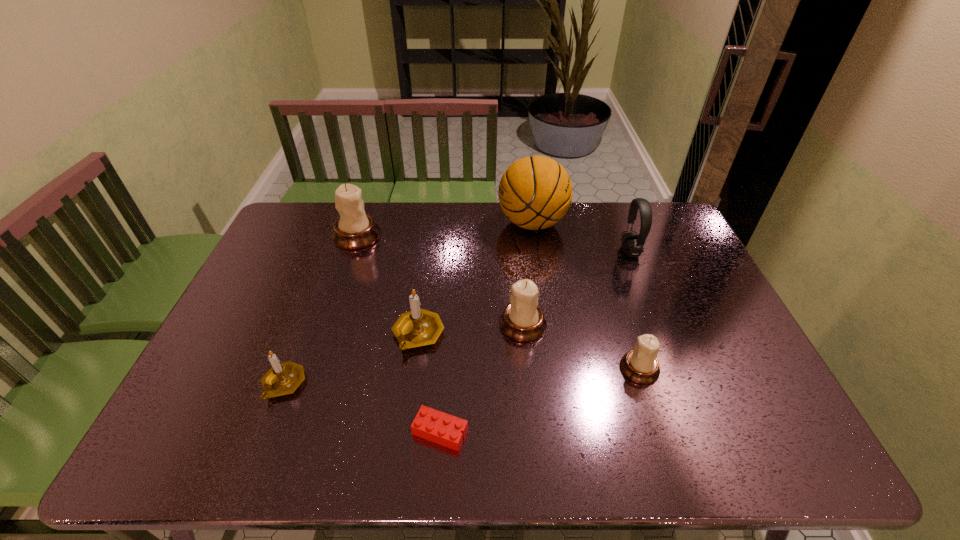
The height and width of the screenshot is (540, 960). I want to click on free spot located 0.070m on the front-facing side of the headset, so click(x=600, y=252).

At what (x,y) coordinates should I click in order to perform the action: click on free point located 0.280m on the front-facing side of the headset. Please return your answer as a coordinate pair (x, y). This screenshot has width=960, height=540. Looking at the image, I should click on (538, 252).

This screenshot has width=960, height=540. What are the coordinates of `free region located 0.210m on the left of the second farthest white candle holder` in the screenshot? It's located at (425, 325).

Where is `free space located 0.270m on the right of the right gold candle holder`? free space located 0.270m on the right of the right gold candle holder is located at coordinates (541, 334).

The height and width of the screenshot is (540, 960). I want to click on vacant space positioned on the back of the rightmost candle holder, so click(x=613, y=288).

I want to click on vacant space located 0.220m on the right of the smaller gold candle holder, so click(x=394, y=384).

The image size is (960, 540). I want to click on vacant space located 0.130m on the back of the red Lego, so tap(444, 368).

Identify the location of basketball at the far edge. [x=535, y=192].

You are a GUI agent. You are given a task and a screenshot of the screen. Output one action in this format:
    pyautogui.click(x=<x>, y=<y>)
    Task: Click on the candle holder that is at the far edge
    
    Given the screenshot: What is the action you would take?
    pyautogui.click(x=354, y=229)

The width and height of the screenshot is (960, 540). In order to click on headset that is positioned at the far edge in this screenshot , I will do `click(632, 244)`.